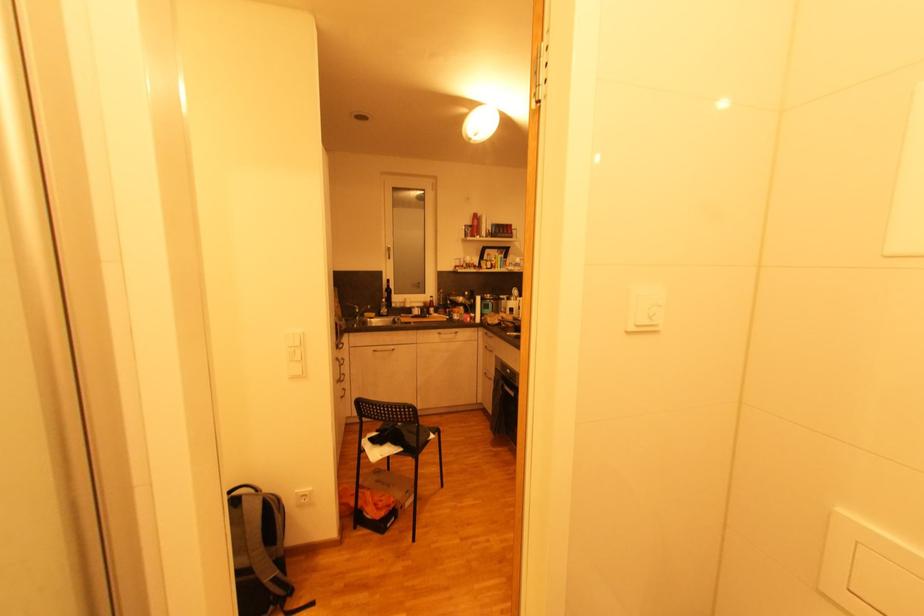
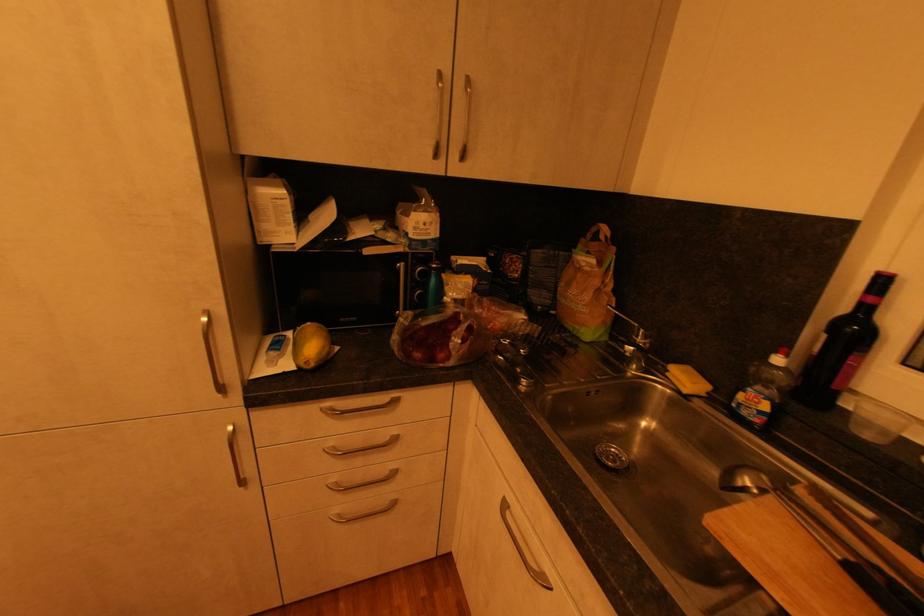
Locate, in the second image, the point that corresponds to point (391, 315) in the first image.

(760, 419)